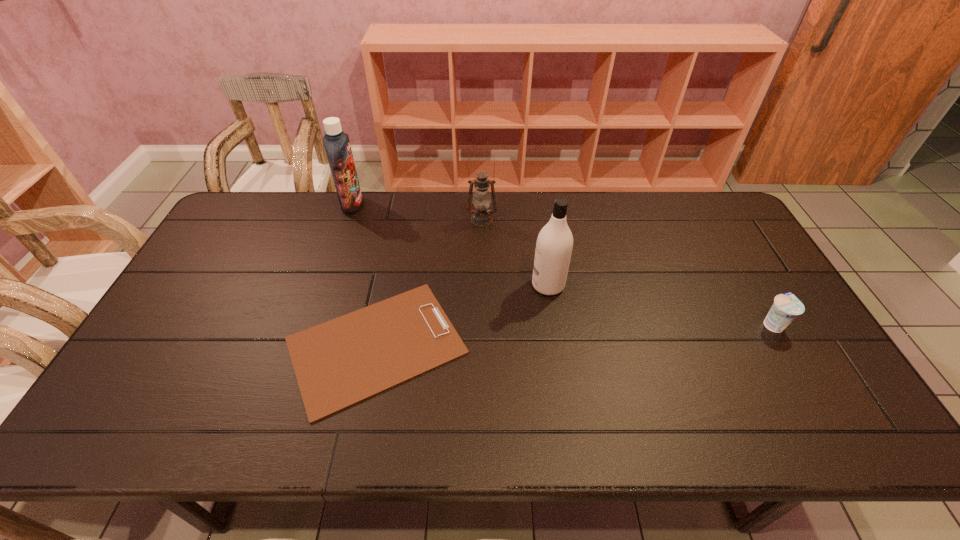
This screenshot has height=540, width=960. Find the location of `object that stands as the fourth closest to the clipboard`. object that stands as the fourth closest to the clipboard is located at coordinates (786, 307).

Find the location of `object that can be found as the second closest to the right shampoo`. object that can be found as the second closest to the right shampoo is located at coordinates (481, 216).

Where is `vacant area that satisfies the following two spatial constraints: 1. on the front label of the rightmost object; 2. on the left side of the left shampoo`? This screenshot has width=960, height=540. vacant area that satisfies the following two spatial constraints: 1. on the front label of the rightmost object; 2. on the left side of the left shampoo is located at coordinates (312, 325).

The height and width of the screenshot is (540, 960). In order to click on vacant space that satisfies the following two spatial constraints: 1. on the front label of the left shampoo; 2. on the left side of the oil lamp in this screenshot , I will do `click(348, 220)`.

You are a GUI agent. You are given a task and a screenshot of the screen. Output one action in this format:
    pyautogui.click(x=<x>, y=<y>)
    Task: Click on the vacant space that satisfies the following two spatial constraints: 1. on the front-facing side of the rightmost object; 2. on the left side of the nearer shampoo
    
    Given the screenshot: What is the action you would take?
    pyautogui.click(x=554, y=325)

The height and width of the screenshot is (540, 960). I want to click on vacant region that satisfies the following two spatial constraints: 1. on the front label of the oil lamp; 2. on the right side of the left shampoo, so click(x=348, y=220).

The width and height of the screenshot is (960, 540). Find the location of `free location that satisfies the following two spatial constraints: 1. on the front-facing side of the nearer shampoo; 2. on the left side of the fourth tallest object`. free location that satisfies the following two spatial constraints: 1. on the front-facing side of the nearer shampoo; 2. on the left side of the fourth tallest object is located at coordinates (554, 325).

Find the location of a particular element. vacant space that satisfies the following two spatial constraints: 1. on the back side of the yogurt; 2. on the front label of the farther shampoo is located at coordinates (703, 205).

Image resolution: width=960 pixels, height=540 pixels. I want to click on vacant area in the image that satisfies the following two spatial constraints: 1. on the front label of the left shampoo; 2. on the back side of the clipboard, so click(305, 346).